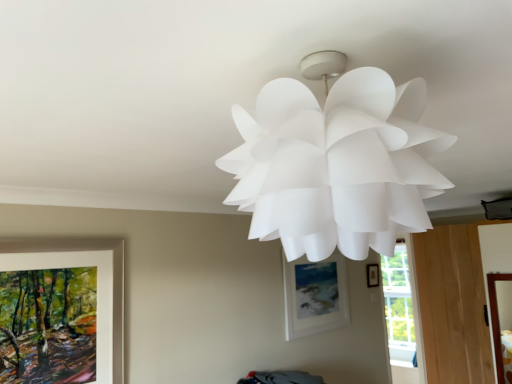
Question: Does white matte picture frame at center, the second picture frame viewed from the back, appear on the left side of white paper lamp at upper center?

Choices:
 (A) yes
 (B) no

Answer: (B)

Question: From a real-world perspective, is white matte picture frame at center, the second picture frame viewed from the back, over white paper lamp at upper center?

Choices:
 (A) yes
 (B) no

Answer: (B)

Question: From the image's perspective, would you say white matte picture frame at center, the 2th picture frame viewed from the front, is shown under white paper lamp at upper center?

Choices:
 (A) yes
 (B) no

Answer: (A)

Question: Is white matte picture frame at center, the 2th picture frame viewed from the front, in front of white paper lamp at upper center?

Choices:
 (A) yes
 (B) no

Answer: (B)

Question: Is white matte picture frame at center, the second picture frame viewed from the back, smaller than white paper lamp at upper center?

Choices:
 (A) yes
 (B) no

Answer: (A)

Question: Considering the positions of matte black picture frame at center-right, which is the first picture frame from back to front, and white paper lamp at upper center in the image, is matte black picture frame at center-right, which is the first picture frame from back to front, bigger or smaller than white paper lamp at upper center?

Choices:
 (A) big
 (B) small

Answer: (B)

Question: Does point (371, 269) appear closer or farther from the camera than point (411, 119)?

Choices:
 (A) farther
 (B) closer

Answer: (A)

Question: From the image's perspective, is matte black picture frame at center-right, which is the first picture frame from back to front, located above or below white paper lamp at upper center?

Choices:
 (A) below
 (B) above

Answer: (A)

Question: Would you say matte black picture frame at center-right, acting as the first picture frame starting from the right, is inside or outside white paper lamp at upper center?

Choices:
 (A) outside
 (B) inside

Answer: (A)

Question: From the image's perspective, is white paper lamp at upper center located above or below white matte picture frame at center, arranged as the second picture frame when viewed from the left?

Choices:
 (A) above
 (B) below

Answer: (A)

Question: In terms of width, does white paper lamp at upper center look wider or thinner when compared to white matte picture frame at center, which is the second picture frame in right-to-left order?

Choices:
 (A) wide
 (B) thin

Answer: (A)

Question: From their relative heights in the image, would you say white paper lamp at upper center is taller or shorter than white matte picture frame at center, arranged as the second picture frame when viewed from the left?

Choices:
 (A) tall
 (B) short

Answer: (B)

Question: In the image, is white paper lamp at upper center positioned in front of or behind white matte picture frame at center, the 2th picture frame viewed from the front?

Choices:
 (A) front
 (B) behind

Answer: (A)

Question: Considering their positions, is white paper lamp at upper center located in front of or behind wooden picture frame at lower left, acting as the first picture frame starting from the left?

Choices:
 (A) behind
 (B) front

Answer: (B)

Question: Is point pos(415,168) closer or farther from the camera than point pos(120,256)?

Choices:
 (A) farther
 (B) closer

Answer: (B)